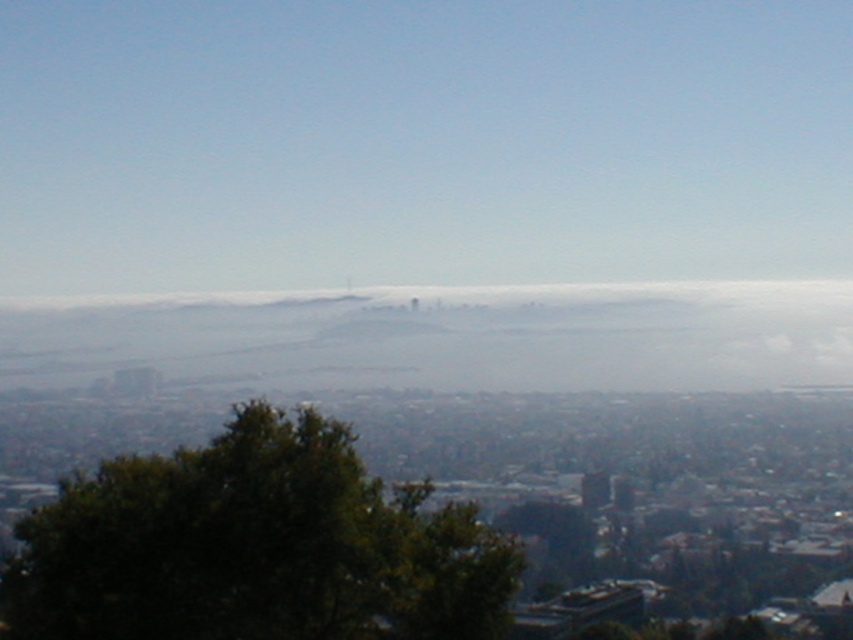
Can you confirm if green leafy tree at center is positioned to the left of foggy white cloud at center?

Indeed, green leafy tree at center is positioned on the left side of foggy white cloud at center.

Between point (250, 604) and point (334, 374), which one is positioned in front?

Point (334, 374) is in front.

Where is `green leafy tree at center`? green leafy tree at center is located at coordinates (254, 547).